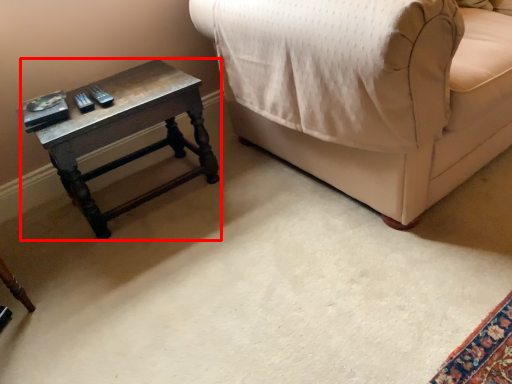
Question: From the image's perspective, what is the correct spatial positioning of table (annotated by the red box) in reference to furniture?

Choices:
 (A) below
 (B) above

Answer: (A)